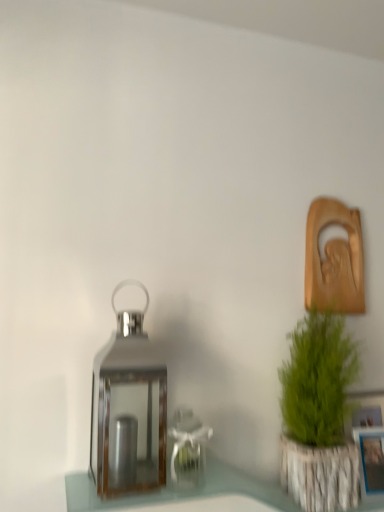
Question: From the image's perspective, is shiny metallic lantern at center above or below blue plastic picture frame at lower right?

Choices:
 (A) below
 (B) above

Answer: (B)

Question: Is shiny metallic lantern at center inside or outside of blue plastic picture frame at lower right?

Choices:
 (A) inside
 (B) outside

Answer: (B)

Question: Considering the real-world distances, which object is closest to the green textured plant at right?

Choices:
 (A) blue plastic picture frame at lower right
 (B) shiny metallic lantern at center

Answer: (A)

Question: Based on their relative distances, which object is farther from the blue plastic picture frame at lower right?

Choices:
 (A) shiny metallic lantern at center
 (B) green textured plant at right

Answer: (A)